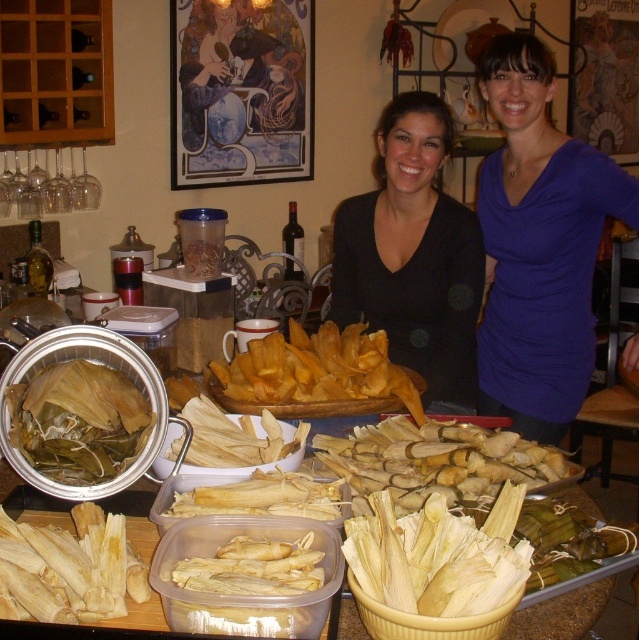
Question: Does purple soft fabric shirt at center have a lesser width compared to white matte corn husks at center?

Choices:
 (A) yes
 (B) no

Answer: (B)

Question: Which point is closer to the camera taking this photo?

Choices:
 (A) (544, 531)
 (B) (56, 481)
 (C) (321, 410)

Answer: (B)

Question: Where is yellow paper tamales at center located in relation to translucent plastic container at center in the image?

Choices:
 (A) left
 (B) right

Answer: (B)

Question: Which of the following is the farthest from the observer?

Choices:
 (A) yellow paper tamales at center
 (B) yellow paper tamales at lower left
 (C) white corn husk tamales at center

Answer: (A)

Question: Considering the relative positions of white corn husk tamales at center and translucent plastic container at center in the image provided, where is white corn husk tamales at center located with respect to translucent plastic container at center?

Choices:
 (A) above
 (B) below

Answer: (A)

Question: Which object is farther from the camera taking this photo?

Choices:
 (A) white corn husk tamales at center
 (B) black matte shirt at center
 (C) yellow paper tamales at center

Answer: (B)